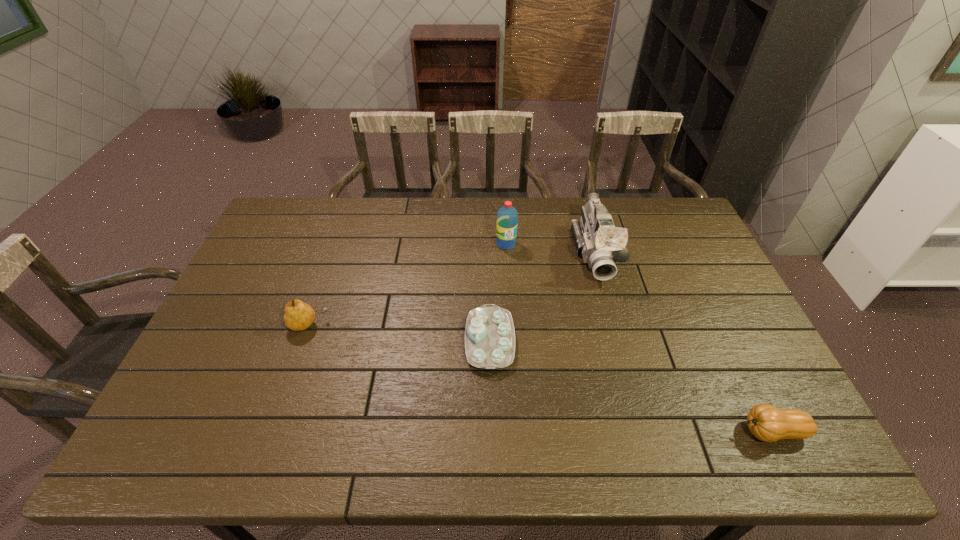
The image size is (960, 540). I want to click on free space at the near edge of the desktop, so click(506, 439).

In the image, there is a desktop. In order to click on blank space at the left edge in this screenshot , I will do `click(207, 382)`.

In the image, there is a desktop. At what (x,y) coordinates should I click in order to perform the action: click on free region at the right edge. Please return your answer as a coordinate pair (x, y). This screenshot has width=960, height=540. Looking at the image, I should click on (668, 253).

Image resolution: width=960 pixels, height=540 pixels. Identify the location of vacant space at the far left corner of the desktop. (285, 218).

You are a GUI agent. You are given a task and a screenshot of the screen. Output one action in this format:
    pyautogui.click(x=<x>, y=<y>)
    Task: Click on the free space between the third shortest object and the fourth object from left to right
    
    Given the screenshot: What is the action you would take?
    pyautogui.click(x=452, y=289)

I want to click on empty space that is in between the camcorder and the chinaware, so click(x=542, y=297).

At what (x,y) coordinates should I click in order to perform the action: click on vacant area that lies between the chinaware and the water bottle. Please return your answer as a coordinate pair (x, y). Looking at the image, I should click on (498, 292).

At what (x,y) coordinates should I click in order to perform the action: click on vacant region between the pear and the nearest object. Please return your answer as a coordinate pair (x, y). This screenshot has height=540, width=960. Looking at the image, I should click on (540, 379).

Locate an element on the screen. vacant space that is in between the water bottle and the pear is located at coordinates (407, 285).

At what (x,y) coordinates should I click in order to perform the action: click on unoccupied area between the second object from right to left and the nearest object. Please return your answer as a coordinate pair (x, y). Looking at the image, I should click on (683, 342).